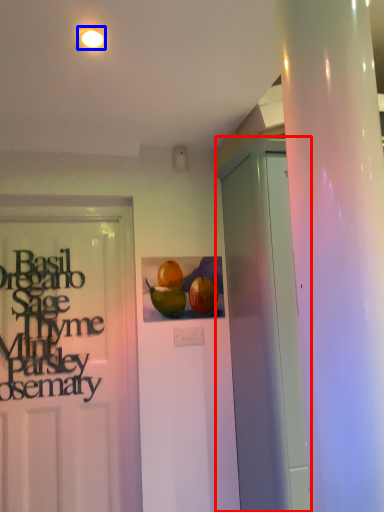
Question: Which of the following is the closest to the observer, garage door (highlighted by a red box) or lighting (highlighted by a blue box)?

Choices:
 (A) garage door
 (B) lighting

Answer: (B)